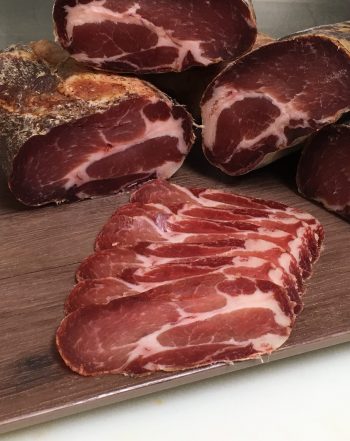
You are a GUI agent. You are given a task and a screenshot of the screen. Output one action in this format:
    pyautogui.click(x=<x>, y=<y>)
    Task: Click on the side of wooden surface
    
    Given the screenshot: What is the action you would take?
    pyautogui.click(x=137, y=394)